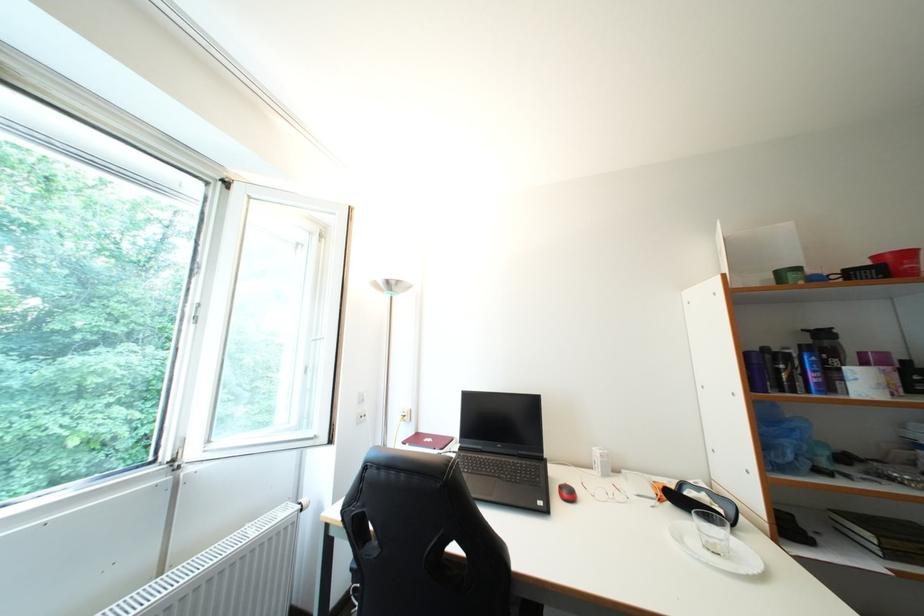
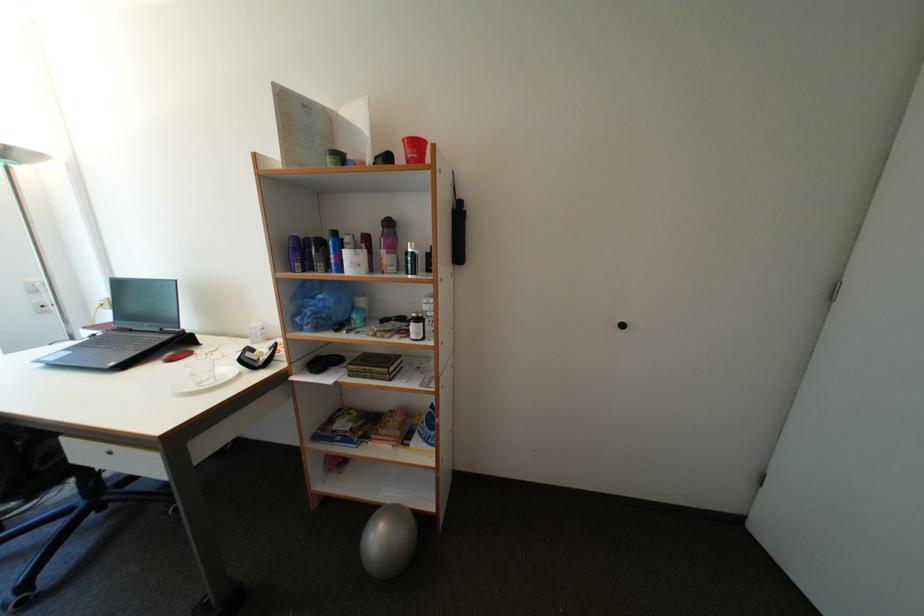
Question: The images are taken continuously from a first-person perspective. In which direction are you moving?

Choices:
 (A) Left
 (B) Right
 (C) Forward
 (D) Backward

Answer: (B)